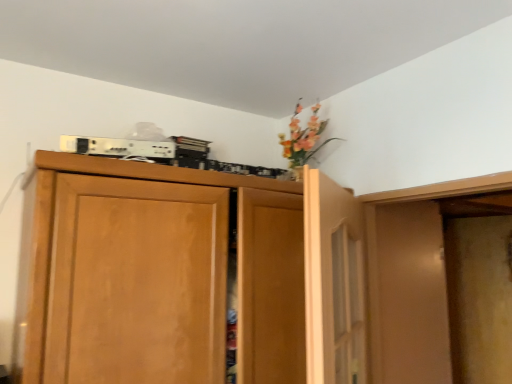
Measure the distance between point (307, 329) and camera.

The distance of point (307, 329) from camera is 1.66 meters.

What do you see at coordinates (333, 282) in the screenshot?
I see `wooden door at upper center` at bounding box center [333, 282].

At what (x,y) coordinates should I click in order to perform the action: click on wooden door at upper center. Please return your answer as a coordinate pair (x, y). Image resolution: width=512 pixels, height=384 pixels. Looking at the image, I should click on pyautogui.click(x=333, y=282).

The width and height of the screenshot is (512, 384). I want to click on wooden cupboard at upper center, so click(x=238, y=275).

Describe the element at coordinates (238, 275) in the screenshot. Image resolution: width=512 pixels, height=384 pixels. I see `wooden cupboard at upper center` at that location.

The image size is (512, 384). Find the location of `wooden door at upper center`. wooden door at upper center is located at coordinates (333, 282).

In the scene shown: Considering the positions of objects wooden cupboard at upper center and wooden door at upper center in the image provided, who is more to the left, wooden cupboard at upper center or wooden door at upper center?

Positioned to the left is wooden cupboard at upper center.

Which is behind, wooden cupboard at upper center or wooden door at upper center?

wooden cupboard at upper center is further away from the camera.

Which is farther from the camera, (397,290) or (345,207)?

The point (397,290) is farther from the camera.

Consider the image. From the image's perspective, relative to wooden door at upper center, is wooden cupboard at upper center above or below?

wooden cupboard at upper center is situated lower than wooden door at upper center in the image.

From a real-world perspective, is wooden cupboard at upper center beneath wooden door at upper center?

Yes, from a real-world perspective, wooden cupboard at upper center is under wooden door at upper center.

Considering the relative sizes of wooden cupboard at upper center and wooden door at upper center in the image provided, is wooden cupboard at upper center thinner than wooden door at upper center?

In fact, wooden cupboard at upper center might be wider than wooden door at upper center.

Considering the relative sizes of wooden cupboard at upper center and wooden door at upper center in the image provided, is wooden cupboard at upper center shorter than wooden door at upper center?

No.

In terms of size, does wooden cupboard at upper center appear bigger or smaller than wooden door at upper center?

Considering their sizes, wooden cupboard at upper center takes up more space than wooden door at upper center.

Choose the correct answer: Is wooden cupboard at upper center inside wooden door at upper center or outside it?

wooden cupboard at upper center lies outside wooden door at upper center.

Is the surface of wooden cupboard at upper center in direct contact with wooden door at upper center?

They are not placed beside each other.

Is wooden cupboard at upper center positioned with its back to wooden door at upper center?

No, wooden cupboard at upper center is not facing the opposite direction of wooden door at upper center.

What are the coordinates of `cupboard directly beneath the wooden door at upper center (from a real-world perspective)` in the screenshot? It's located at (238, 275).

Is wooden door at upper center at the left side of wooden cupboard at upper center?

Incorrect, wooden door at upper center is not on the left side of wooden cupboard at upper center.

Which object is closer to the camera taking this photo, wooden door at upper center or wooden cupboard at upper center?

wooden door at upper center.

Does point (357, 310) come in front of point (490, 203)?

Yes.

From the image's perspective, would you say wooden door at upper center is shown under wooden cupboard at upper center?

Incorrect, from the image's perspective, wooden door at upper center is higher than wooden cupboard at upper center.

From a real-world perspective, is wooden door at upper center physically located above or below wooden cupboard at upper center?

From a real-world perspective, wooden door at upper center is physically above wooden cupboard at upper center.

Can you confirm if wooden door at upper center is thinner than wooden cupboard at upper center?

Correct, the width of wooden door at upper center is less than that of wooden cupboard at upper center.

Which of these two, wooden door at upper center or wooden cupboard at upper center, stands shorter?

wooden door at upper center.

Is wooden door at upper center smaller than wooden cupboard at upper center?

Yes.

Is wooden door at upper center inside or outside of wooden cupboard at upper center?

wooden door at upper center is not enclosed by wooden cupboard at upper center.

Based on the photo, is wooden door at upper center not near wooden cupboard at upper center?

That's not correct — wooden door at upper center is a little close to wooden cupboard at upper center.

Is wooden door at upper center turned away from wooden cupboard at upper center?

Yes, wooden cupboard at upper center is at the back of wooden door at upper center.

At what (x,y) coordinates should I click in order to perform the action: click on cupboard that appears behind the wooden door at upper center. Please return your answer as a coordinate pair (x, y). Looking at the image, I should click on (238, 275).

Where is `cupboard on the left of wooden door at upper center`? This screenshot has height=384, width=512. cupboard on the left of wooden door at upper center is located at coordinates (238, 275).

Locate an element on the screen. door in front of the wooden cupboard at upper center is located at coordinates (333, 282).